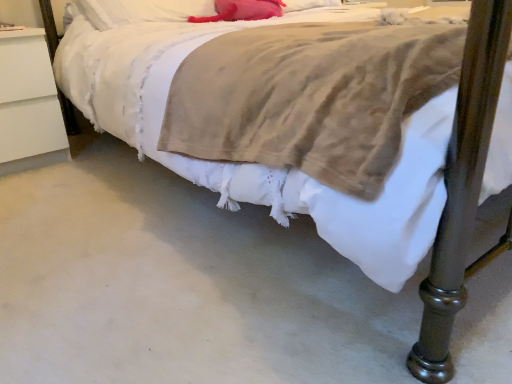
Question: From the image's perspective, is white soft pillow at upper center, acting as the 1th pillow starting from the left, above or below matte pink pillow at upper center, the 2th pillow positioned from the left?

Choices:
 (A) below
 (B) above

Answer: (A)

Question: Based on their sizes in the image, would you say white soft pillow at upper center, which is counted as the 2th pillow, starting from the right, is bigger or smaller than matte pink pillow at upper center, the 2th pillow positioned from the left?

Choices:
 (A) big
 (B) small

Answer: (A)

Question: Which object is the farthest from the white soft pillow at upper center, acting as the 1th pillow starting from the left?

Choices:
 (A) white matte nightstand at left
 (B) matte pink pillow at upper center, the 2th pillow positioned from the left

Answer: (A)

Question: Based on their relative distances, which object is nearer to the matte pink pillow at upper center, the 2th pillow positioned from the left?

Choices:
 (A) white matte nightstand at left
 (B) white soft pillow at upper center, acting as the 1th pillow starting from the left

Answer: (B)